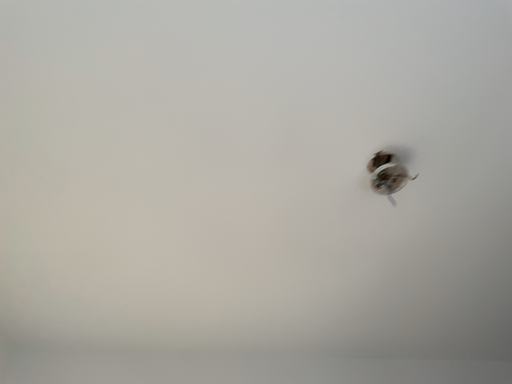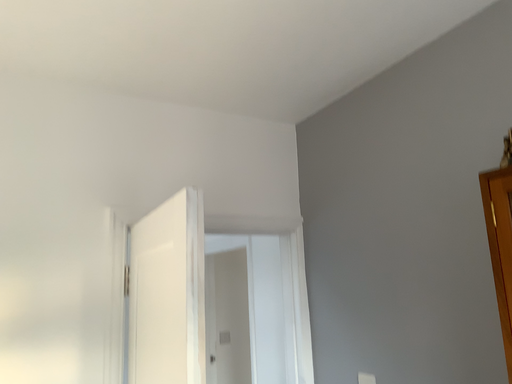
Question: Which way did the camera rotate in the video?

Choices:
 (A) rotated right
 (B) rotated left

Answer: (A)